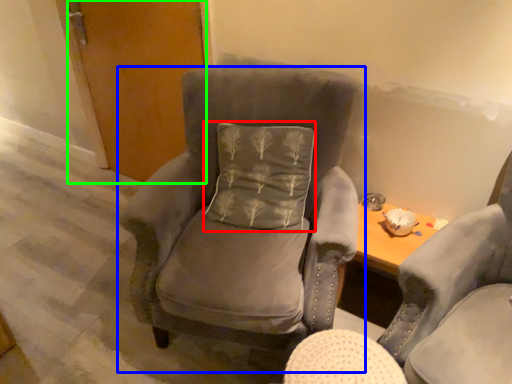
Question: Which object is the farthest from pillow (highlighted by a red box)? Choose among these: chair (highlighted by a blue box) or door (highlighted by a green box).

Choices:
 (A) chair
 (B) door

Answer: (B)